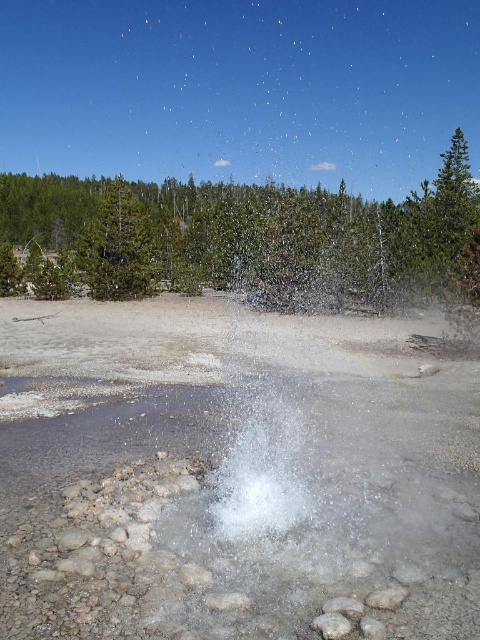
You are a photographer trying to capture the geyser and the forest in one shot. The camera you have can only focus on objects within a 10 meter width. Given that the clear water at center is narrower than the green leafy tree at upper center, will both fit within the camera frame?

The clear water at center has a width less than the green leafy tree at upper center. Since the camera can focus on objects within 10 meters, and the clear water at center is narrower, both can fit within the frame as their combined width would be under 10 meters.

Looking at this image, you are a geologist studying the geyser field. You need to mark the exact location of the clear water at center on your map. What are its coordinates?

The clear water at center is located at coordinates point (240, 515).

You are standing at the edge of the geothermal area and see two points in the scene. Which point, point (141, 241) or point (152, 266), is closer to you?

Point (141, 241) is closer to the viewer than point (152, 266).